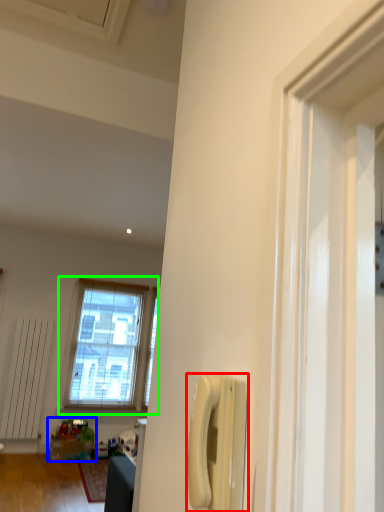
Question: Based on their relative distances, which object is farther from corded phone (highlighted by a red box)? Choose from toy (highlighted by a blue box) and window (highlighted by a green box).

Choices:
 (A) toy
 (B) window

Answer: (B)